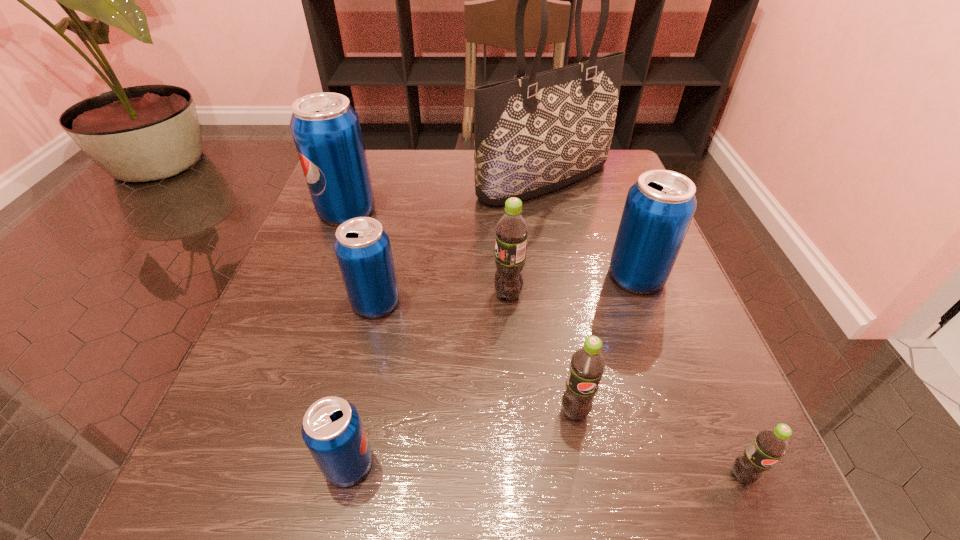
Find the location of `vacant space at the near edge`. vacant space at the near edge is located at coordinates (612, 531).

Locate an element on the screen. This screenshot has width=960, height=540. vacant area at the left edge of the desktop is located at coordinates pos(310,226).

What are the coordinates of `vacant space at the right edge` in the screenshot? It's located at (725, 437).

Locate an element on the screen. The image size is (960, 540). free space at the near left corner of the desktop is located at coordinates (300, 480).

You are a GUI agent. You are given a task and a screenshot of the screen. Output one action in this format:
    pyautogui.click(x=<x>, y=<y>)
    Task: Click on the empty space between the second smallest blue pop soda and the tote bag
    The image size is (960, 540).
    Given the screenshot: What is the action you would take?
    pyautogui.click(x=460, y=241)

This screenshot has width=960, height=540. Identify the location of free space that is in between the smallest green soda and the tallest object. (643, 327).

Where is `free space between the leftmost blue pop soda and the nearest blue pop soda`? The height and width of the screenshot is (540, 960). free space between the leftmost blue pop soda and the nearest blue pop soda is located at coordinates (348, 338).

At what (x,y) coordinates should I click in order to perform the action: click on empty location between the nearest green soda and the tote bag. Please return your answer as a coordinate pair (x, y). The width and height of the screenshot is (960, 540). Looking at the image, I should click on (643, 327).

Identify the location of free spot between the smallest green soda and the smallest blue pop soda. Image resolution: width=960 pixels, height=540 pixels. (545, 470).

You are a GUI agent. You are given a task and a screenshot of the screen. Output one action in this format:
    pyautogui.click(x=<x>, y=<y>)
    Task: Click on the vacant area that lies between the smallest green soda and the second biggest blue pop soda
    This screenshot has width=960, height=540.
    Given the screenshot: What is the action you would take?
    pyautogui.click(x=689, y=376)